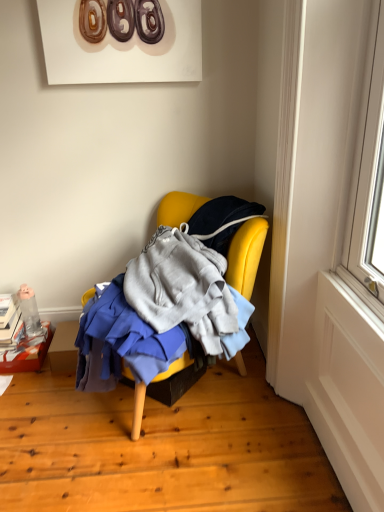
Question: From a real-world perspective, is cardboard box at lower left located higher than yellow fabric chair at center?

Choices:
 (A) no
 (B) yes

Answer: (A)

Question: Is cardboard box at lower left positioned beyond the bounds of yellow fabric chair at center?

Choices:
 (A) yes
 (B) no

Answer: (A)

Question: Is cardboard box at lower left closer to the viewer compared to yellow fabric chair at center?

Choices:
 (A) yes
 (B) no

Answer: (B)

Question: Considering the relative positions of cardboard box at lower left and yellow fabric chair at center in the image provided, is cardboard box at lower left to the left of yellow fabric chair at center from the viewer's perspective?

Choices:
 (A) yes
 (B) no

Answer: (A)

Question: Does cardboard box at lower left have a greater height compared to yellow fabric chair at center?

Choices:
 (A) yes
 (B) no

Answer: (B)

Question: From a real-world perspective, relative to yellow fabric chair at center, is translucent plastic bottle at lower left vertically above or below?

Choices:
 (A) above
 (B) below

Answer: (B)

Question: Is translucent plastic bottle at lower left spatially inside yellow fabric chair at center, or outside of it?

Choices:
 (A) outside
 (B) inside

Answer: (A)

Question: In the image, is translucent plastic bottle at lower left on the left side or the right side of yellow fabric chair at center?

Choices:
 (A) left
 (B) right

Answer: (A)

Question: Is translucent plastic bottle at lower left bigger or smaller than yellow fabric chair at center?

Choices:
 (A) small
 (B) big

Answer: (A)

Question: Is yellow fabric chair at center situated inside cardboard box at lower left or outside?

Choices:
 (A) outside
 (B) inside

Answer: (A)

Question: From the image's perspective, is yellow fabric chair at center above or below cardboard box at lower left?

Choices:
 (A) above
 (B) below

Answer: (A)

Question: Is yellow fabric chair at center taller or shorter than cardboard box at lower left?

Choices:
 (A) short
 (B) tall

Answer: (B)

Question: Looking at the image, does yellow fabric chair at center seem bigger or smaller compared to cardboard box at lower left?

Choices:
 (A) big
 (B) small

Answer: (A)

Question: Is point (43, 349) positioned closer to the camera than point (173, 223)?

Choices:
 (A) farther
 (B) closer

Answer: (A)

Question: Relative to yellow fabric chair at center, is cardboard box at lower left in front or behind?

Choices:
 (A) front
 (B) behind

Answer: (B)